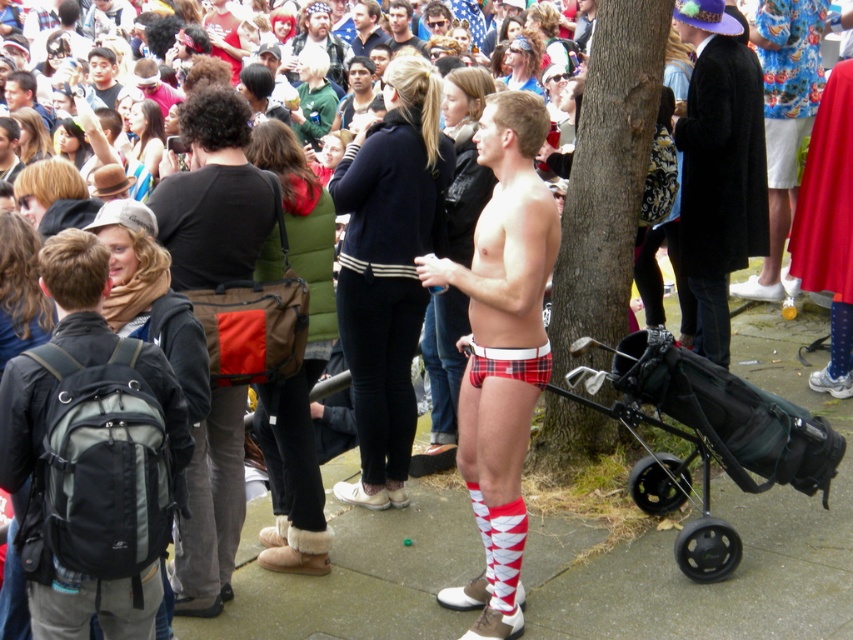
Question: Which of these objects is positioned farthest from the black fabric backpack at lower left?

Choices:
 (A) brown textured tree trunk at center
 (B) matte black coat at center
 (C) black textured golf bag at lower right

Answer: (B)

Question: Can you confirm if dark brown leather jacket at center is wider than beige fabric hat at upper center?

Choices:
 (A) no
 (B) yes

Answer: (A)

Question: Which point is closer to the camera?

Choices:
 (A) black textured golf bag at lower right
 (B) plaid fabric shorts at center
 (C) brown textured tree trunk at center

Answer: (B)

Question: Is black textured golf bag at lower right below matte black coat at center?

Choices:
 (A) no
 (B) yes

Answer: (B)

Question: Is dark brown leather jacket at center above dark green sweater at upper center?

Choices:
 (A) yes
 (B) no

Answer: (B)

Question: Which object is positioned closest to the black textured golf bag at lower right?

Choices:
 (A) black fabric backpack at lower left
 (B) brown textured tree trunk at center
 (C) plaid fabric shorts at center
 (D) dark brown leather jacket at center

Answer: (C)